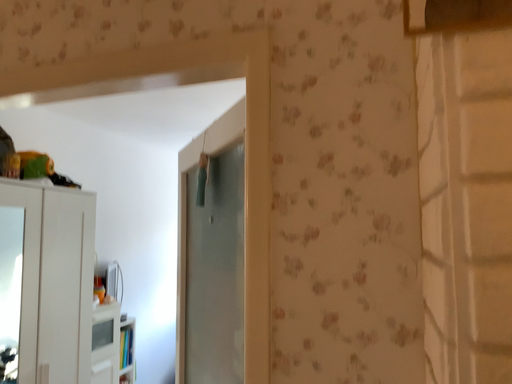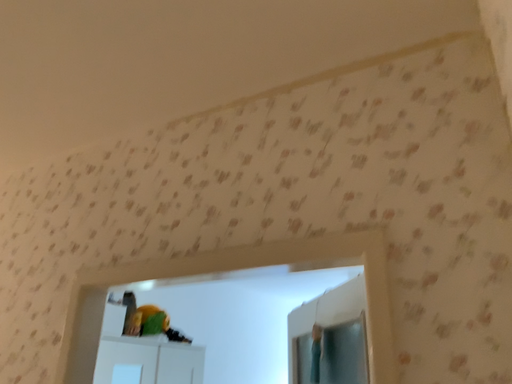
Question: How did the camera likely rotate when shooting the video?

Choices:
 (A) rotated downward
 (B) rotated upward

Answer: (B)